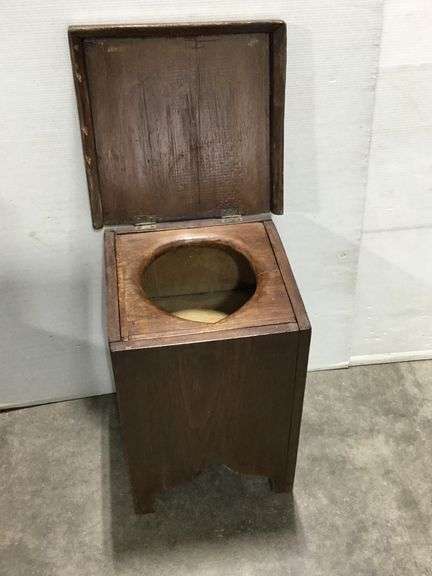
This screenshot has width=432, height=576. Identify the location of toilet. (188, 295).